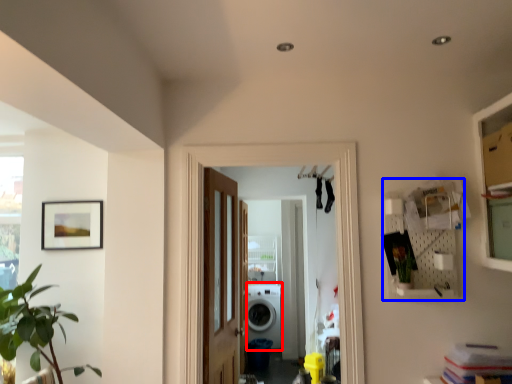
Question: Which object appears farthest to the camera in this image, washing machine (highlighted by a red box) or shelf (highlighted by a blue box)?

Choices:
 (A) washing machine
 (B) shelf

Answer: (A)